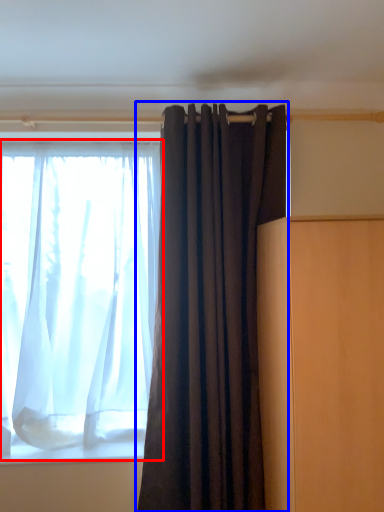
Question: Which object is further to the camera taking this photo, curtain (highlighted by a red box) or curtain (highlighted by a blue box)?

Choices:
 (A) curtain
 (B) curtain

Answer: (A)